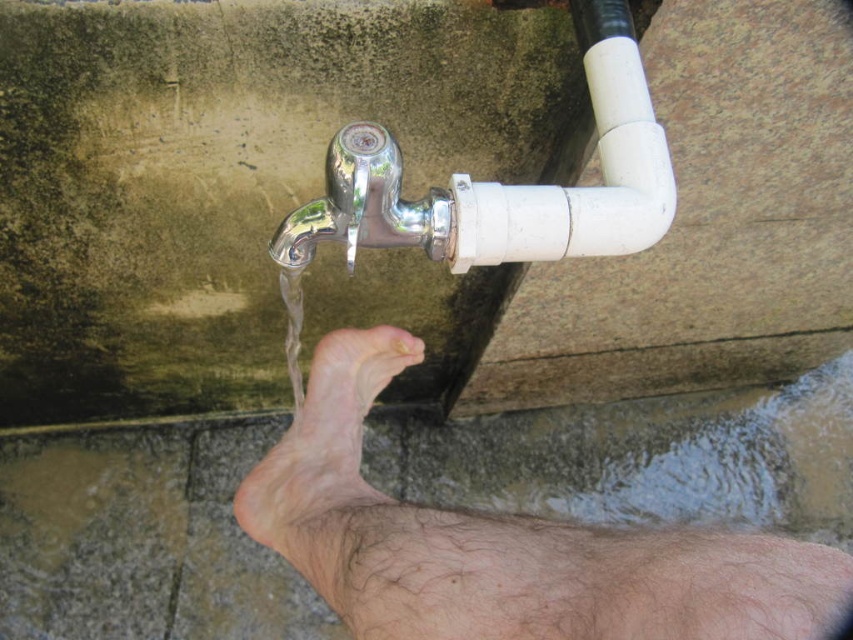
Question: Does hair-covered skin foot at lower center have a greater width compared to pale skin foot at lower center?

Choices:
 (A) no
 (B) yes

Answer: (B)

Question: Does chrome/polished metal water pipe at upper center have a larger size compared to chrome metallic faucet at upper center?

Choices:
 (A) yes
 (B) no

Answer: (A)

Question: Is hair-covered skin foot at lower center smaller than pale skin foot at lower center?

Choices:
 (A) no
 (B) yes

Answer: (A)

Question: Considering the real-world distances, which object is farthest from the hair-covered skin foot at lower center?

Choices:
 (A) chrome/polished metal water pipe at upper center
 (B) chrome metallic faucet at upper center
 (C) pale skin foot at lower center

Answer: (A)

Question: Which point is farther from the camera taking this photo?

Choices:
 (A) (372, 182)
 (B) (257, 477)
 (C) (403, 212)
 (D) (316, 362)

Answer: (D)

Question: Which point is farther to the camera?

Choices:
 (A) (289, 253)
 (B) (328, 392)
 (C) (697, 576)
 (D) (421, 221)

Answer: (B)